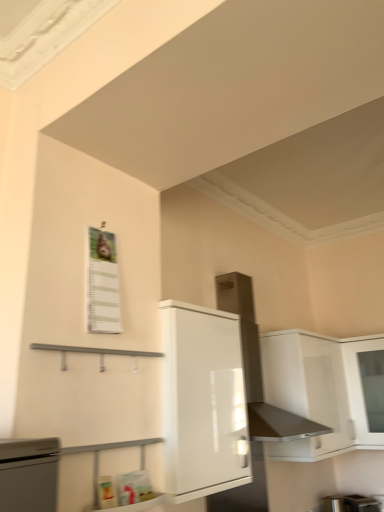
Question: Is white glossy cabinet at upper right, positioned as the second cabinetry in front-to-back order, located within satin silver exhaust hood at upper center?

Choices:
 (A) no
 (B) yes

Answer: (A)

Question: Is satin silver exhaust hood at upper center not close to white glossy cabinet at upper right, the 2th cabinetry in the left-to-right sequence?

Choices:
 (A) no
 (B) yes

Answer: (A)

Question: Is satin silver exhaust hood at upper center positioned before white glossy cabinet at upper right, the 2th cabinetry in the left-to-right sequence?

Choices:
 (A) no
 (B) yes

Answer: (B)

Question: From a real-world perspective, is satin silver exhaust hood at upper center positioned under white glossy cabinet at upper right, positioned as the second cabinetry in front-to-back order, based on gravity?

Choices:
 (A) yes
 (B) no

Answer: (B)

Question: Can you confirm if satin silver exhaust hood at upper center is wider than white glossy cabinet at upper right, which is counted as the first cabinetry, starting from the back?

Choices:
 (A) yes
 (B) no

Answer: (B)

Question: Is satin silver exhaust hood at upper center to the right of white glossy cabinet at upper right, positioned as the second cabinetry in front-to-back order, from the viewer's perspective?

Choices:
 (A) yes
 (B) no

Answer: (B)

Question: Is white glossy cabinet at center, which is counted as the first cabinetry, starting from the front, positioned before white glossy cabinet at upper right, positioned as the second cabinetry in front-to-back order?

Choices:
 (A) no
 (B) yes

Answer: (B)

Question: Considering the relative positions of white glossy cabinet at center, which is counted as the first cabinetry, starting from the front, and white glossy cabinet at upper right, the 2th cabinetry in the left-to-right sequence, in the image provided, is white glossy cabinet at center, which is counted as the first cabinetry, starting from the front, to the right of white glossy cabinet at upper right, the 2th cabinetry in the left-to-right sequence, from the viewer's perspective?

Choices:
 (A) no
 (B) yes

Answer: (A)

Question: From a real-world perspective, does white glossy cabinet at center, the 2th cabinetry when ordered from right to left, stand above white glossy cabinet at upper right, the 2th cabinetry in the left-to-right sequence?

Choices:
 (A) yes
 (B) no

Answer: (B)

Question: Is white glossy cabinet at center, which is the 1th cabinetry in left-to-right order, further to camera compared to white glossy cabinet at upper right, which is the first cabinetry in right-to-left order?

Choices:
 (A) yes
 (B) no

Answer: (B)

Question: From a real-world perspective, is white glossy cabinet at center, which is the 1th cabinetry in left-to-right order, beneath white glossy cabinet at upper right, which is the first cabinetry in right-to-left order?

Choices:
 (A) no
 (B) yes

Answer: (B)

Question: Does white glossy cabinet at center, which is counted as the second cabinetry, starting from the back, have a lesser width compared to white glossy cabinet at upper right, the 2th cabinetry in the left-to-right sequence?

Choices:
 (A) yes
 (B) no

Answer: (A)

Question: Is white glossy cabinet at center, which is counted as the first cabinetry, starting from the front, positioned with its back to satin silver exhaust hood at upper center?

Choices:
 (A) yes
 (B) no

Answer: (B)